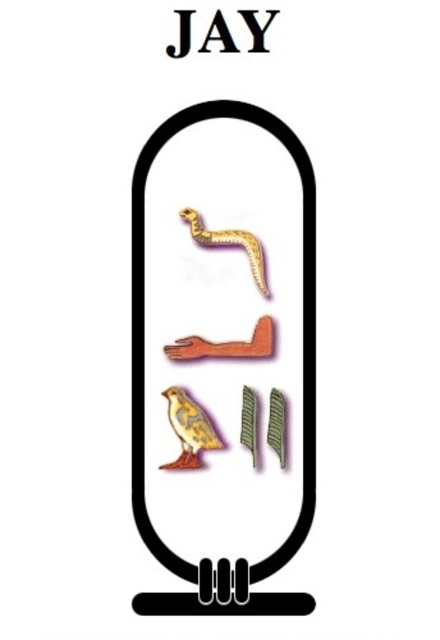
What is the color and material of the object located at point [230,244] in the Egyptian cartouche?

The object at point [230,244] is a gold metallic snake.

You are an archaeologist examining an ancient Egyptian cartouche. You notice two objects inside the cartouche. The golden textured bird at center and the black paper jay at upper center. Which of these two objects appears wider in the image?

The golden textured bird at center appears wider than the black paper jay at upper center because its width is larger according to the description.